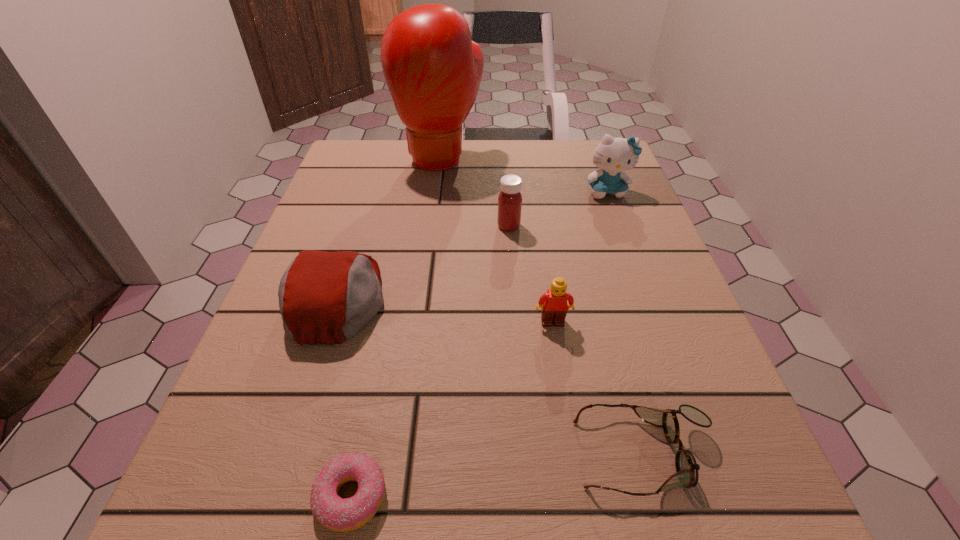
In order to click on vacant space located on the striking surface of the farthest object in this screenshot , I will do `click(425, 275)`.

Where is `vacant space situated on the face of the second farthest object`? This screenshot has width=960, height=540. vacant space situated on the face of the second farthest object is located at coordinates click(x=644, y=293).

The width and height of the screenshot is (960, 540). In order to click on free space located on the back of the medicine in this screenshot , I will do `click(505, 183)`.

Identify the location of vacant space situated 0.360m on the front-facing side of the cap. The width and height of the screenshot is (960, 540). (585, 299).

The height and width of the screenshot is (540, 960). What are the coordinates of `free spot located 0.320m on the face of the Lego` in the screenshot? It's located at (587, 539).

I want to click on free space located on the front-facing side of the sixth tallest object, so click(503, 454).

The image size is (960, 540). I want to click on vacant space located on the front-facing side of the sixth tallest object, so coord(384,454).

This screenshot has height=540, width=960. In order to click on vacant area situated on the front-facing side of the sixth tallest object in this screenshot , I will do `click(444, 454)`.

Identify the location of free location located 0.320m on the right of the doughnut. This screenshot has height=540, width=960. (642, 496).

Where is `boxing glove that is at the far edge`? The width and height of the screenshot is (960, 540). boxing glove that is at the far edge is located at coordinates (433, 69).